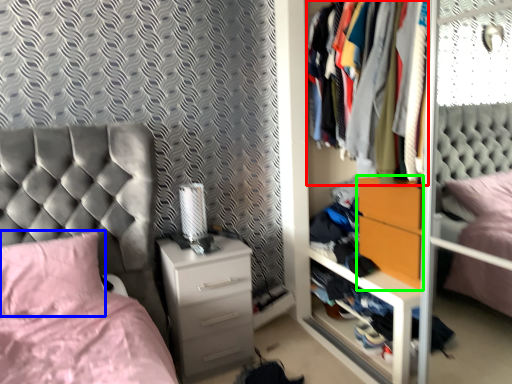
Question: Based on their relative distances, which object is farther from clothing (highlighted by a red box)? Choose from pillow (highlighted by a blue box) and nightstand (highlighted by a green box).

Choices:
 (A) pillow
 (B) nightstand

Answer: (A)